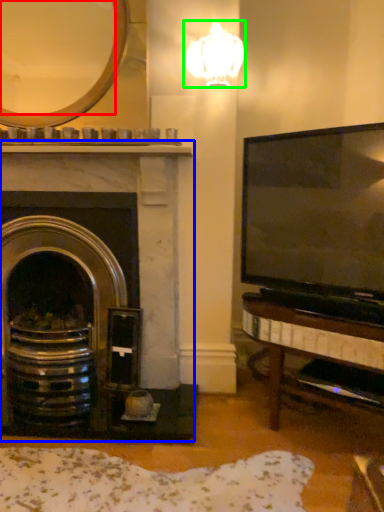
Question: Based on their relative distances, which object is nearer to mirror (highlighted by a red box)? Choose from fireplace (highlighted by a blue box) and lamp (highlighted by a green box).

Choices:
 (A) fireplace
 (B) lamp

Answer: (B)